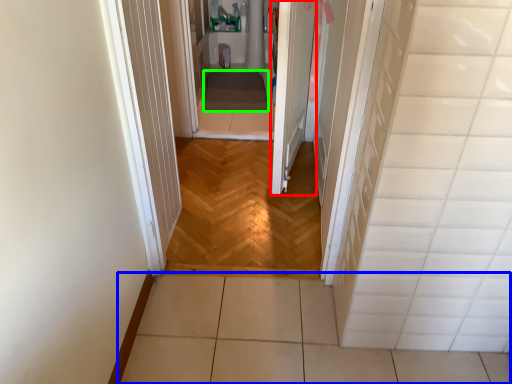
Question: Which is farther away from door (highlighted by a red box)? path (highlighted by a blue box) or blanket (highlighted by a green box)?

Choices:
 (A) path
 (B) blanket

Answer: (A)